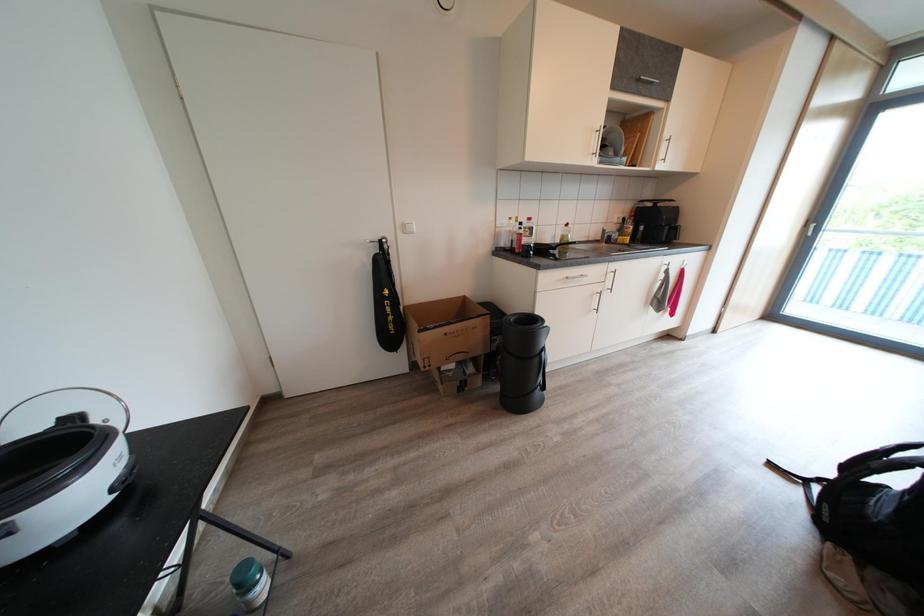
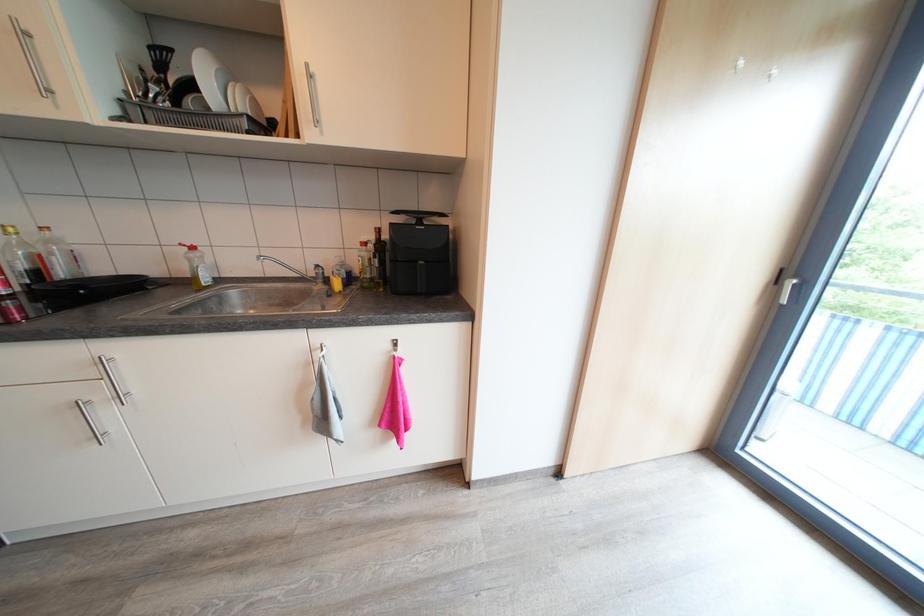
Looking at this image, in a continuous first-person perspective shot, in which direction is the camera moving?

The cameraman moved toward right, forward.